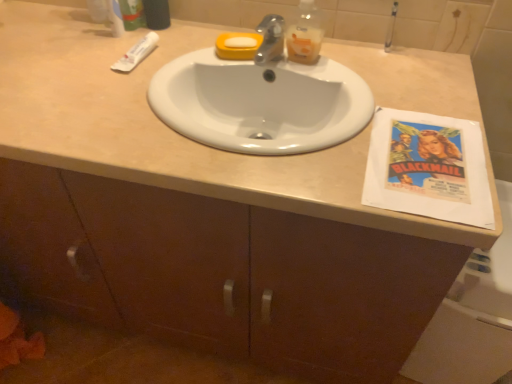
The image size is (512, 384). Identify the location of vacant area that is in front of translucent plastic bottle at upper center. (336, 84).